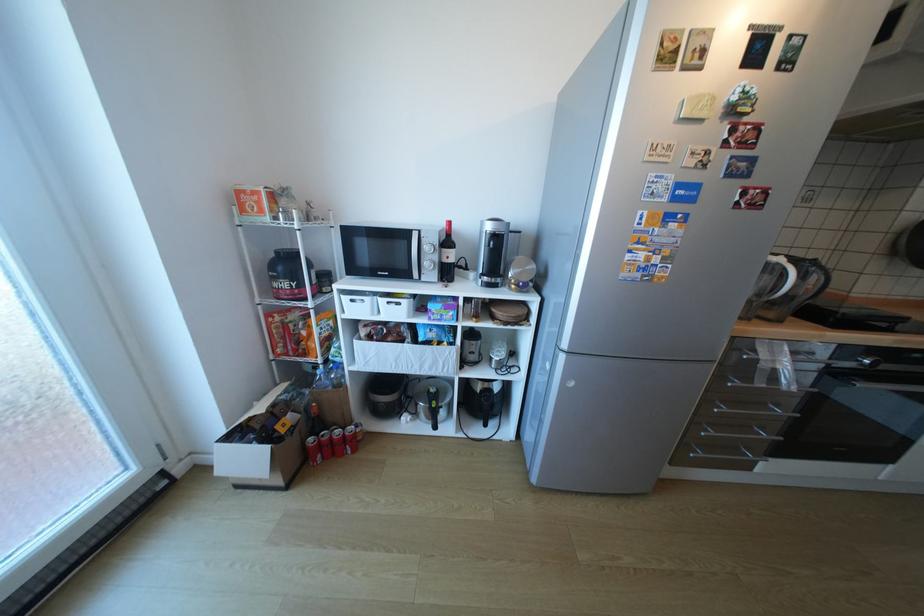
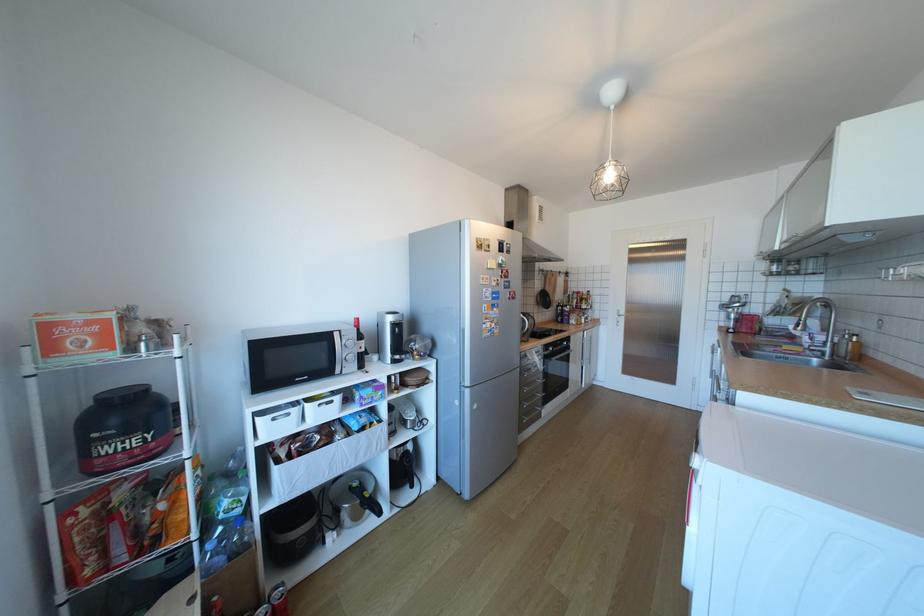
Locate, in the second image, the point that corresponds to (694,446) in the first image.

(529, 419)